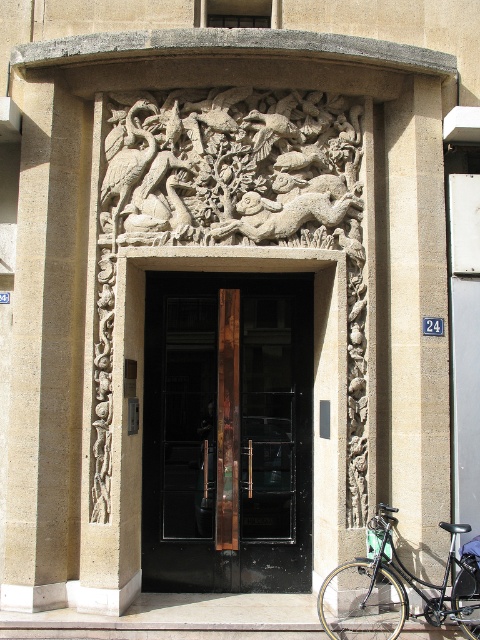
Does black glass door at center have a greater height compared to white stone relief at center?

Indeed, black glass door at center has a greater height compared to white stone relief at center.

Measure the distance between point (250, 344) and camera.

They are 22.63 feet apart.

This screenshot has width=480, height=640. Identify the location of black glass door at center. (228, 433).

Between smooth stone pillar at left and beige stone pillar at right, which one is positioned lower?

smooth stone pillar at left is lower down.

Can you confirm if smooth stone pillar at left is positioned to the right of beige stone pillar at right?

No, smooth stone pillar at left is not to the right of beige stone pillar at right.

This screenshot has height=640, width=480. What are the coordinates of `smooth stone pillar at left` in the screenshot? It's located at (46, 352).

Measure the distance between point (300, 227) and camera.

A distance of 6.32 meters exists between point (300, 227) and camera.

Can you confirm if white stone relief at center is smaller than beige stone pillar at right?

Indeed, white stone relief at center has a smaller size compared to beige stone pillar at right.

Image resolution: width=480 pixels, height=640 pixels. What are the coordinates of `white stone relief at center` in the screenshot? It's located at (232, 168).

Where is `white stone relief at center`? The width and height of the screenshot is (480, 640). white stone relief at center is located at coordinates (232, 168).